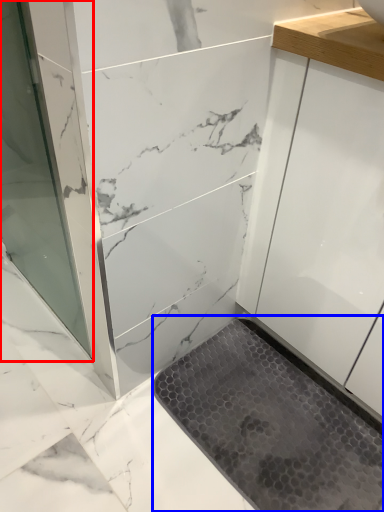
Question: Which of the following is the closest to the observer, screen door (highlighted by a red box) or bath mat (highlighted by a blue box)?

Choices:
 (A) screen door
 (B) bath mat

Answer: (A)